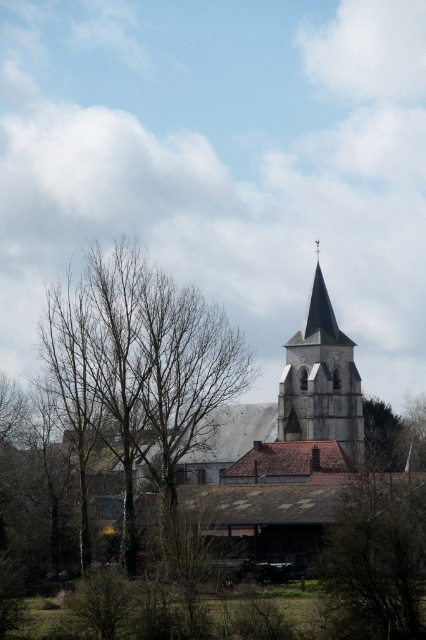
You are standing in the rural landscape and want to know if the brown wood tree at center is wider than the smooth gray steeple at center. Can you determine this based on the scene?

The brown wood tree at center might be wider than smooth gray steeple at center according to the scene description.

You are standing in front of the church and looking at two points marked on the bell tower. The first point is at coordinates point [143,417] and the second is at point [319,385]. Which point is closer to you?

Point [143,417] is closer to the viewer than point [319,385].